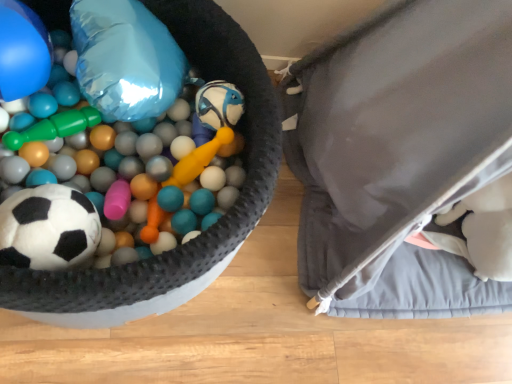
Identify the location of gray fabric bean bag chair at right. Image resolution: width=512 pixels, height=384 pixels. (399, 154).

This screenshot has height=384, width=512. What do you see at coordinates (22, 51) in the screenshot?
I see `blue glossy balloon at upper left, the second balloon in the right-to-left sequence` at bounding box center [22, 51].

Identify the location of soft plush soccer ball at left. This screenshot has height=384, width=512. (148, 98).

Can you confirm if white matte soccer ball at left is taller than soft plush soccer ball at left?

Yes.

Based on the photo, measure the distance between white matte soccer ball at left and soft plush soccer ball at left.

white matte soccer ball at left and soft plush soccer ball at left are 7.11 inches apart from each other.

Is soft plush soccer ball at left inside white matte soccer ball at left?

That's incorrect, soft plush soccer ball at left is not inside white matte soccer ball at left.

Which object is positioned more to the left, white matte soccer ball at left or soft plush soccer ball at left?

Positioned to the left is white matte soccer ball at left.

From the image's perspective, is soft plush soccer ball at left under white matte soccer ball at left?

No.

What's the angular difference between soft plush soccer ball at left and white matte soccer ball at left's facing directions?

6.81e-05 degrees separate the facing orientations of soft plush soccer ball at left and white matte soccer ball at left.

Is white matte soccer ball at left at the back of soft plush soccer ball at left?

No, soft plush soccer ball at left is not facing the opposite direction of white matte soccer ball at left.

Considering the sizes of soft plush soccer ball at left and gray fabric bean bag chair at right in the image, is soft plush soccer ball at left wider or thinner than gray fabric bean bag chair at right?

Considering their sizes, soft plush soccer ball at left looks slimmer than gray fabric bean bag chair at right.

Consider the image. From a real-world perspective, is soft plush soccer ball at left over gray fabric bean bag chair at right?

No, from a real-world perspective, soft plush soccer ball at left is not above gray fabric bean bag chair at right.

Can you tell me how much soft plush soccer ball at left and gray fabric bean bag chair at right differ in facing direction?

They differ by 6.71 degrees in their facing directions.

Is soft plush soccer ball at left spatially inside gray fabric bean bag chair at right, or outside of it?

soft plush soccer ball at left cannot be found inside gray fabric bean bag chair at right.

How many degrees apart are the facing directions of blue glossy balloon at upper left, the second balloon in the right-to-left sequence, and white matte soccer ball at left?

3.4e-05 degrees separate the facing orientations of blue glossy balloon at upper left, the second balloon in the right-to-left sequence, and white matte soccer ball at left.

Considering the sizes of blue glossy balloon at upper left, which is the first balloon in left-to-right order, and white matte soccer ball at left in the image, is blue glossy balloon at upper left, which is the first balloon in left-to-right order, wider or thinner than white matte soccer ball at left?

Clearly, blue glossy balloon at upper left, which is the first balloon in left-to-right order, has more width compared to white matte soccer ball at left.

Is blue glossy balloon at upper left, the second balloon in the right-to-left sequence, next to white matte soccer ball at left and touching it?

There is a gap between blue glossy balloon at upper left, the second balloon in the right-to-left sequence, and white matte soccer ball at left.

Is blue glossy balloon at upper left, which is the first balloon in left-to-right order, positioned in front of white matte soccer ball at left?

No, blue glossy balloon at upper left, which is the first balloon in left-to-right order, is further to the viewer.

Consider the image. Does blue glossy balloon at upper left, the second balloon in the right-to-left sequence, have a lesser height compared to soft plush soccer ball at left?

Incorrect, the height of blue glossy balloon at upper left, the second balloon in the right-to-left sequence, does not fall short of that of soft plush soccer ball at left.

Is blue glossy balloon at upper left, which is the first balloon in left-to-right order, smaller than soft plush soccer ball at left?

Indeed, blue glossy balloon at upper left, which is the first balloon in left-to-right order, has a smaller size compared to soft plush soccer ball at left.

Considering the positions of point (28, 17) and point (135, 104), is point (28, 17) closer or farther from the camera than point (135, 104)?

Point (28, 17) is closer to the camera than point (135, 104).

How many degrees apart are the facing directions of blue glossy balloon at upper left, the second balloon in the right-to-left sequence, and soft plush soccer ball at left?

The facing directions of blue glossy balloon at upper left, the second balloon in the right-to-left sequence, and soft plush soccer ball at left are 5.3e-05 degrees apart.

Where is `the 2nd balloon positioned above the soft plush soccer ball at left (from the image's perspective)`? The width and height of the screenshot is (512, 384). the 2nd balloon positioned above the soft plush soccer ball at left (from the image's perspective) is located at coordinates pos(126,59).

From the image's perspective, is soft plush soccer ball at left above or below shiny metallic balloon at upper left, the first balloon viewed from the right?

soft plush soccer ball at left is situated lower than shiny metallic balloon at upper left, the first balloon viewed from the right, in the image.

Which object is positioned more to the right, soft plush soccer ball at left or shiny metallic balloon at upper left, which is the second balloon in left-to-right order?

Positioned to the right is shiny metallic balloon at upper left, which is the second balloon in left-to-right order.

Does soft plush soccer ball at left have a lesser width compared to shiny metallic balloon at upper left, the first balloon viewed from the right?

Incorrect, the width of soft plush soccer ball at left is not less than that of shiny metallic balloon at upper left, the first balloon viewed from the right.

Identify the location of the 2nd balloon above when counting from the soft plush soccer ball at left (from the image's perspective). The image size is (512, 384). click(x=126, y=59).

From the image's perspective, between shiny metallic balloon at upper left, which is the second balloon in left-to-right order, and soft plush soccer ball at left, who is located below?

soft plush soccer ball at left appears lower in the image.

Looking at this image, which of these two, shiny metallic balloon at upper left, which is the second balloon in left-to-right order, or soft plush soccer ball at left, is bigger?

With larger size is soft plush soccer ball at left.

Consider the image. Considering the sizes of objects shiny metallic balloon at upper left, the first balloon viewed from the right, and soft plush soccer ball at left in the image provided, who is taller, shiny metallic balloon at upper left, the first balloon viewed from the right, or soft plush soccer ball at left?

soft plush soccer ball at left.

Locate an element on the screen. This screenshot has height=384, width=512. toy beneath the white matte soccer ball at left (from a real-world perspective) is located at coordinates (148, 98).

Where is `football in front of the soft plush soccer ball at left`? football in front of the soft plush soccer ball at left is located at coordinates (48, 228).

Which object lies nearer to the anchor point gray fabric bean bag chair at right, soft plush soccer ball at left or white matte soccer ball at left?

soft plush soccer ball at left lies closer to gray fabric bean bag chair at right than the other object.

When comparing their distances from soft plush soccer ball at left, does blue glossy balloon at upper left, the second balloon in the right-to-left sequence, or gray fabric bean bag chair at right seem further?

gray fabric bean bag chair at right is positioned further to the anchor soft plush soccer ball at left.

Looking at the image, which one is located closer to blue glossy balloon at upper left, the second balloon in the right-to-left sequence, gray fabric bean bag chair at right or soft plush soccer ball at left?

soft plush soccer ball at left is closer to blue glossy balloon at upper left, the second balloon in the right-to-left sequence.

Considering their positions, is white matte soccer ball at left positioned further to shiny metallic balloon at upper left, which is the second balloon in left-to-right order, than gray fabric bean bag chair at right?

gray fabric bean bag chair at right is positioned further to the anchor shiny metallic balloon at upper left, which is the second balloon in left-to-right order.

Which object lies nearer to the anchor point shiny metallic balloon at upper left, the first balloon viewed from the right, gray fabric bean bag chair at right or blue glossy balloon at upper left, the second balloon in the right-to-left sequence?

Among the two, blue glossy balloon at upper left, the second balloon in the right-to-left sequence, is located nearer to shiny metallic balloon at upper left, the first balloon viewed from the right.

When comparing their distances from gray fabric bean bag chair at right, does soft plush soccer ball at left or shiny metallic balloon at upper left, which is the second balloon in left-to-right order, seem closer?

soft plush soccer ball at left.

Based on their spatial positions, is blue glossy balloon at upper left, the second balloon in the right-to-left sequence, or gray fabric bean bag chair at right closer to white matte soccer ball at left?

blue glossy balloon at upper left, the second balloon in the right-to-left sequence.

Based on their spatial positions, is gray fabric bean bag chair at right or blue glossy balloon at upper left, the second balloon in the right-to-left sequence, closer to white matte soccer ball at left?

blue glossy balloon at upper left, the second balloon in the right-to-left sequence, is closer to white matte soccer ball at left.

Identify the location of toy between blue glossy balloon at upper left, the second balloon in the right-to-left sequence, and gray fabric bean bag chair at right. The image size is (512, 384). (148, 98).

This screenshot has width=512, height=384. Find the location of `toy between shiny metallic balloon at upper left, which is the second balloon in left-to-right order, and white matte soccer ball at left, in the vertical direction`. toy between shiny metallic balloon at upper left, which is the second balloon in left-to-right order, and white matte soccer ball at left, in the vertical direction is located at coordinates [x=148, y=98].

This screenshot has width=512, height=384. What are the coordinates of `football between blue glossy balloon at upper left, the second balloon in the right-to-left sequence, and gray fabric bean bag chair at right, in the horizontal direction` in the screenshot? It's located at (48, 228).

Where is `balloon between white matte soccer ball at left and gray fabric bean bag chair at right from left to right`? The width and height of the screenshot is (512, 384). balloon between white matte soccer ball at left and gray fabric bean bag chair at right from left to right is located at coordinates (126, 59).